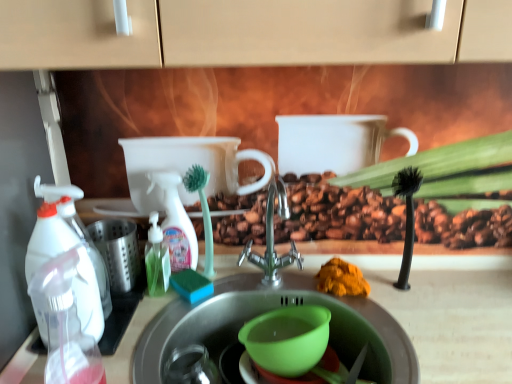
Locate an element on the screen. The width and height of the screenshot is (512, 384). vacant space situated on the left part of orange powder at sink is located at coordinates (272, 282).